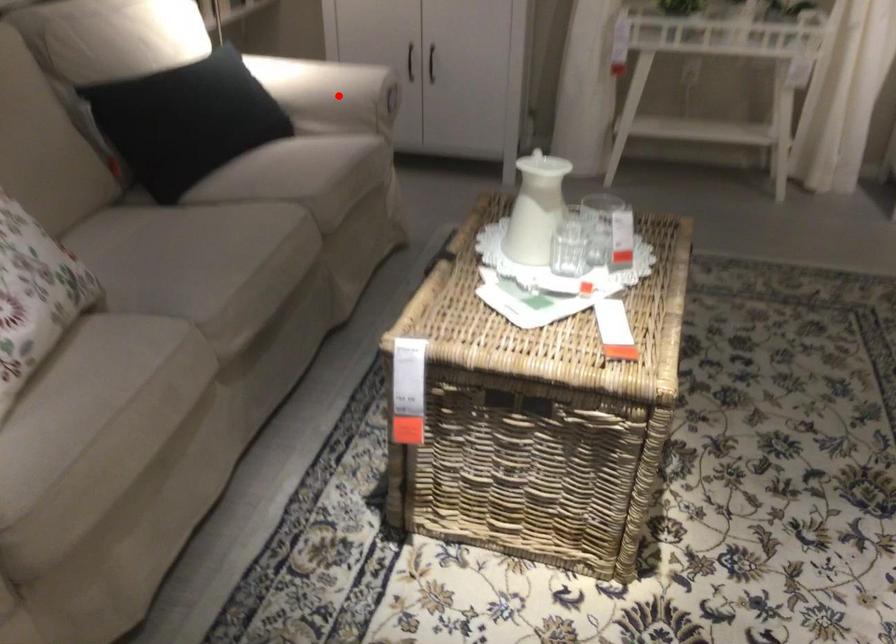
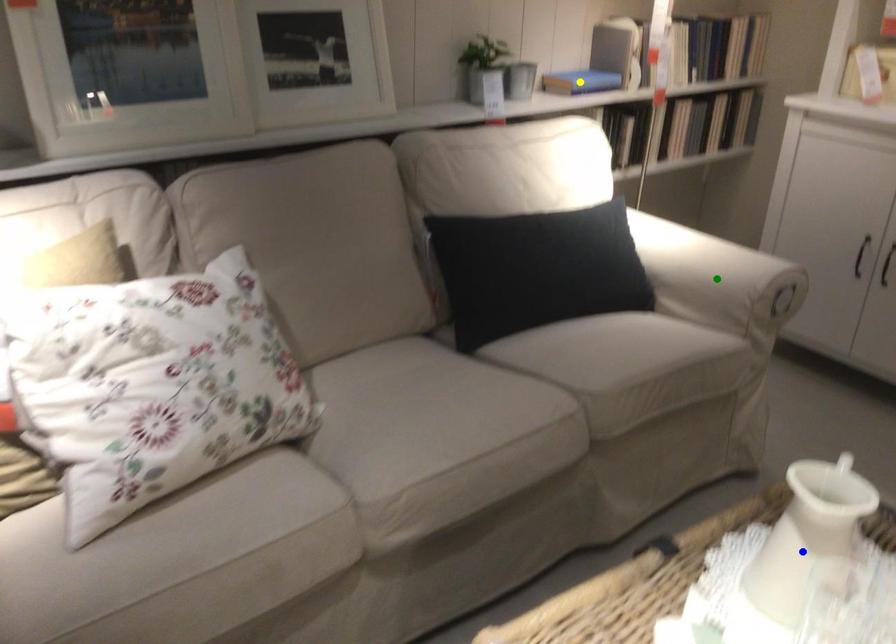
Question: I am providing you with two images of the same scene from different viewpoints. A red point is marked on the first image. You are given multiple points on the second image. In image 2, which mark is for the same physical point as the one in image 1?

Choices:
 (A) yellow point
 (B) blue point
 (C) green point

Answer: (C)